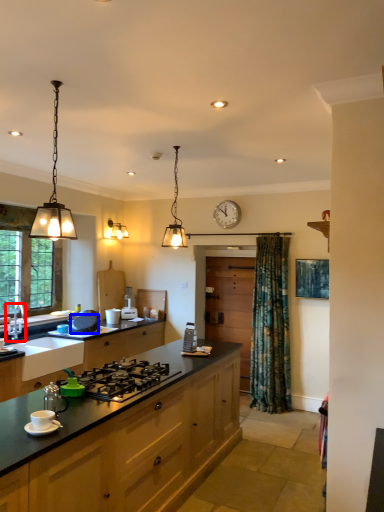
Question: Which point is further to the camera, tap (highlighted by a red box) or appliance (highlighted by a blue box)?

Choices:
 (A) tap
 (B) appliance

Answer: (B)